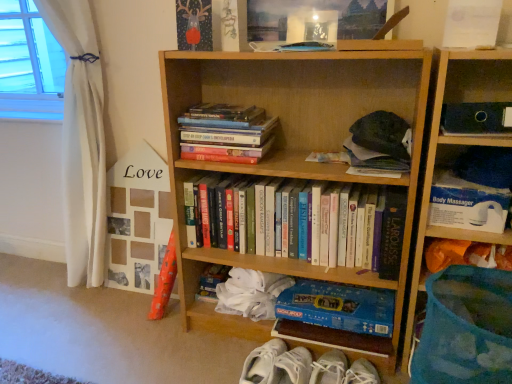
This screenshot has height=384, width=512. What do you see at coordinates (476, 118) in the screenshot?
I see `matte black folder at upper right` at bounding box center [476, 118].

Identify the location of blue plastic basket at right, which is the 2th bookcase in left-to-right order. (455, 148).

I want to click on wooden bookcase at center, acting as the second bookcase starting from the right, so click(x=292, y=145).

In order to click on shelf lying below the wooden bookcase at center, acting as the second bookcase starting from the right (from the image's perspective) in this screenshot , I will do `click(473, 191)`.

Is wooden bookcase at center, acting as the second bookcase starting from the right, far away from white plastic body massager at upper right?

No, wooden bookcase at center, acting as the second bookcase starting from the right, is not far from white plastic body massager at upper right.

Is wooden bookcase at center, acting as the second bookcase starting from the right, looking in the opposite direction of white plastic body massager at upper right?

No, wooden bookcase at center, acting as the second bookcase starting from the right, is not facing the opposite direction of white plastic body massager at upper right.

From a real-world perspective, is wooden bookcase at center, which appears as the first bookcase when viewed from the left, on white fabric sneakers at lower center?

Yes, from a real-world perspective, wooden bookcase at center, which appears as the first bookcase when viewed from the left, is above white fabric sneakers at lower center.

Considering the points (404, 268) and (272, 356), which point is behind, point (404, 268) or point (272, 356)?

The point (272, 356) is farther from the camera.

Considering the relative sizes of wooden bookcase at center, acting as the second bookcase starting from the right, and white fabric sneakers at lower center in the image provided, is wooden bookcase at center, acting as the second bookcase starting from the right, thinner than white fabric sneakers at lower center?

No, wooden bookcase at center, acting as the second bookcase starting from the right, is not thinner than white fabric sneakers at lower center.

From a real-world perspective, is white plastic body massager at upper right under blue cardboard monopoly game at lower center, the fourth book when ordered from top to bottom?

Actually, white plastic body massager at upper right is physically above blue cardboard monopoly game at lower center, the fourth book when ordered from top to bottom, in the real world.

From their relative heights in the image, would you say white plastic body massager at upper right is taller or shorter than blue cardboard monopoly game at lower center, which is counted as the 1th book, starting from the bottom?

white plastic body massager at upper right is shorter than blue cardboard monopoly game at lower center, which is counted as the 1th book, starting from the bottom.

Consider the image. Does white plastic body massager at upper right turn towards blue cardboard monopoly game at lower center, which is counted as the 1th book, starting from the bottom?

No.

Is white plastic body massager at upper right beside blue cardboard monopoly game at lower center, which is counted as the 1th book, starting from the bottom?

white plastic body massager at upper right and blue cardboard monopoly game at lower center, which is counted as the 1th book, starting from the bottom, are not in contact.

From the image's perspective, is hardcover books at upper left, which is counted as the second book, starting from the top, positioned above or below blue plastic basket at right, the first bookcase when ordered from right to left?

hardcover books at upper left, which is counted as the second book, starting from the top, is above blue plastic basket at right, the first bookcase when ordered from right to left.

Can you confirm if hardcover books at upper left, the 3th book from the bottom, is wider than blue plastic basket at right, the first bookcase when ordered from right to left?

Incorrect, the width of hardcover books at upper left, the 3th book from the bottom, does not surpass that of blue plastic basket at right, the first bookcase when ordered from right to left.

Does hardcover books at upper left, which is counted as the second book, starting from the top, lie in front of blue plastic basket at right, which is the 2th bookcase in left-to-right order?

No, it is not.

The image size is (512, 384). Find the location of `the 2nd bookcase counting from the right of the hardcover books at upper left, the 3th book from the bottom`. the 2nd bookcase counting from the right of the hardcover books at upper left, the 3th book from the bottom is located at coordinates (455, 148).

This screenshot has width=512, height=384. I want to click on the 3rd book counting from the left of the matte black folder at upper right, so click(295, 223).

Is matte black folder at upper right looking in the opposite direction of hardcover books at center, positioned as the 2th book in bottom-to-top order?

No, matte black folder at upper right's orientation is not away from hardcover books at center, positioned as the 2th book in bottom-to-top order.

Is matte black folder at upper right shorter than hardcover books at center, acting as the third book starting from the top?

Yes, matte black folder at upper right is shorter than hardcover books at center, acting as the third book starting from the top.

In the image, is matte black folder at upper right on the left side or the right side of hardcover books at center, positioned as the 2th book in bottom-to-top order?

matte black folder at upper right is to the right of hardcover books at center, positioned as the 2th book in bottom-to-top order.

Between hardcover books at center, acting as the third book starting from the top, and hardcover book at upper center, which appears as the first book when viewed from the top, which one has larger size?

hardcover books at center, acting as the third book starting from the top.

From a real-world perspective, is hardcover books at center, positioned as the 2th book in bottom-to-top order, physically above hardcover book at upper center, which appears as the first book when viewed from the top?

No, from a real-world perspective, hardcover books at center, positioned as the 2th book in bottom-to-top order, is not over hardcover book at upper center, which appears as the first book when viewed from the top

Is hardcover book at upper center, which appears as the fourth book when ordered from the bottom, surrounded by hardcover books at center, acting as the third book starting from the top?

Actually, hardcover book at upper center, which appears as the fourth book when ordered from the bottom, is outside hardcover books at center, acting as the third book starting from the top.

Does hardcover books at center, positioned as the 2th book in bottom-to-top order, turn towards hardcover book at upper center, which appears as the fourth book when ordered from the bottom?

No, hardcover books at center, positioned as the 2th book in bottom-to-top order, is not oriented towards hardcover book at upper center, which appears as the fourth book when ordered from the bottom.

From a real-world perspective, is white fabric sneakers at lower center positioned under hardcover books at center, positioned as the 2th book in bottom-to-top order, based on gravity?

Correct, in the physical world, white fabric sneakers at lower center is lower than hardcover books at center, positioned as the 2th book in bottom-to-top order.

From the image's perspective, is white fabric sneakers at lower center under hardcover books at center, acting as the third book starting from the top?

Indeed, from the image's perspective, white fabric sneakers at lower center is shown beneath hardcover books at center, acting as the third book starting from the top.

In terms of height, does white fabric sneakers at lower center look taller or shorter compared to hardcover books at center, acting as the third book starting from the top?

In the image, white fabric sneakers at lower center appears to be shorter than hardcover books at center, acting as the third book starting from the top.

The width and height of the screenshot is (512, 384). Find the location of `shelf on the right of the wooden bookcase at center, which appears as the first bookcase when viewed from the left`. shelf on the right of the wooden bookcase at center, which appears as the first bookcase when viewed from the left is located at coordinates (473, 191).

Where is `footwear behind the wooden bookcase at center, acting as the second bookcase starting from the right`? The width and height of the screenshot is (512, 384). footwear behind the wooden bookcase at center, acting as the second bookcase starting from the right is located at coordinates (303, 367).

Which object lies further to the anchor point blue plastic basket at right, the first bookcase when ordered from right to left, blue cardboard monopoly game at lower center, the fourth book when ordered from top to bottom, or wooden bookcase at center, acting as the second bookcase starting from the right?

blue cardboard monopoly game at lower center, the fourth book when ordered from top to bottom, is further to blue plastic basket at right, the first bookcase when ordered from right to left.

Estimate the real-world distances between objects in this image. Which object is closer to wooden bookcase at center, which appears as the first bookcase when viewed from the left, hardcover books at upper left, which is counted as the second book, starting from the top, or hardcover book at upper center, which appears as the first book when viewed from the top?

hardcover books at upper left, which is counted as the second book, starting from the top.

From the image, which object appears to be nearer to white fabric curtain at left, white plastic body massager at upper right or wooden bookcase at center, which appears as the first bookcase when viewed from the left?

wooden bookcase at center, which appears as the first bookcase when viewed from the left.

When comparing their distances from matte black folder at upper right, does white fabric sneakers at lower center or blue cardboard monopoly game at lower center, which is counted as the 1th book, starting from the bottom, seem closer?

Based on the image, blue cardboard monopoly game at lower center, which is counted as the 1th book, starting from the bottom, appears to be nearer to matte black folder at upper right.

Estimate the real-world distances between objects in this image. Which object is closer to hardcover books at upper left, the 3th book from the bottom, white fabric curtain at left or wooden bookcase at center, acting as the second bookcase starting from the right?

Among the two, wooden bookcase at center, acting as the second bookcase starting from the right, is located nearer to hardcover books at upper left, the 3th book from the bottom.

In the scene shown: Looking at the image, which one is located closer to white fabric sneakers at lower center, blue plastic basket at right, which is the 2th bookcase in left-to-right order, or white fabric curtain at left?

blue plastic basket at right, which is the 2th bookcase in left-to-right order, lies closer to white fabric sneakers at lower center than the other object.

In the scene shown: Based on their spatial positions, is hardcover books at center, positioned as the 2th book in bottom-to-top order, or hardcover books at upper left, which is counted as the second book, starting from the top, further from white plastic body massager at upper right?

hardcover books at upper left, which is counted as the second book, starting from the top, lies further to white plastic body massager at upper right than the other object.

Which object lies nearer to the anchor point hardcover books at center, positioned as the 2th book in bottom-to-top order, blue plastic basket at right, the first bookcase when ordered from right to left, or hardcover books at upper left, which is counted as the second book, starting from the top?

Among the two, hardcover books at upper left, which is counted as the second book, starting from the top, is located nearer to hardcover books at center, positioned as the 2th book in bottom-to-top order.

Identify the location of bookcase between white fabric curtain at left and blue cardboard monopoly game at lower center, which is counted as the 1th book, starting from the bottom, in the horizontal direction. (292, 145).

The width and height of the screenshot is (512, 384). In order to click on shelf that lies between wooden bookcase at center, which appears as the first bookcase when viewed from the left, and white fabric sneakers at lower center from top to bottom in this screenshot , I will do `click(473, 191)`.

Where is `bookcase between white fabric curtain at left and blue plastic basket at right, which is the 2th bookcase in left-to-right order, from left to right`? The height and width of the screenshot is (384, 512). bookcase between white fabric curtain at left and blue plastic basket at right, which is the 2th bookcase in left-to-right order, from left to right is located at coordinates (292, 145).

You are a GUI agent. You are given a task and a screenshot of the screen. Output one action in this format:
    pyautogui.click(x=<x>, y=<y>)
    Task: Click on the bookcase between hardcover book at upper center, which appears as the first book when viewed from the top, and hardcover books at center, acting as the third book starting from the top, in the vertical direction
    
    Given the screenshot: What is the action you would take?
    pyautogui.click(x=292, y=145)